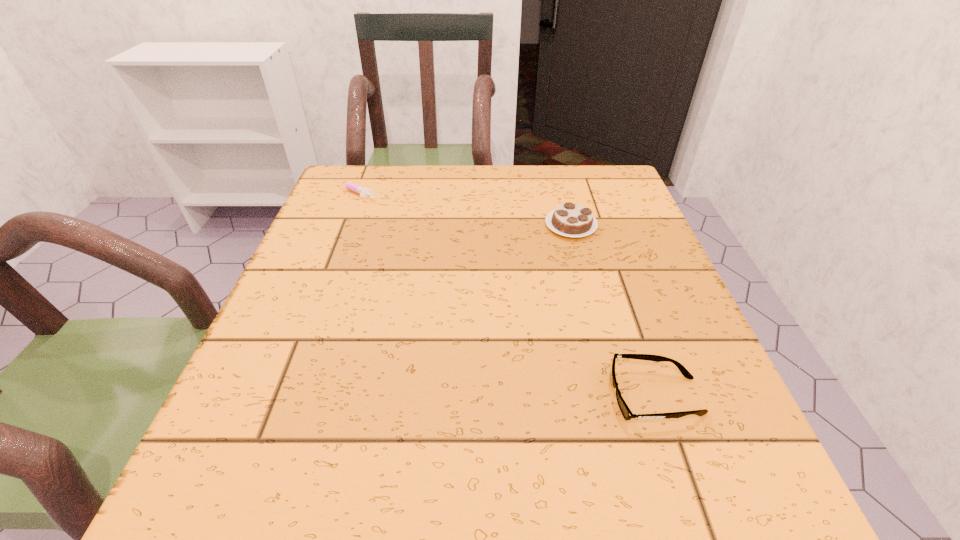
Where is `chocolate cake`? chocolate cake is located at coordinates (571, 220).

At what (x,y) coordinates should I click in order to perform the action: click on the nearest object. Please return your answer as a coordinate pair (x, y). The height and width of the screenshot is (540, 960). Looking at the image, I should click on (626, 412).

Identify the location of syringe. Image resolution: width=960 pixels, height=540 pixels. (363, 192).

Locate an element on the screen. the farthest object is located at coordinates (363, 192).

Image resolution: width=960 pixels, height=540 pixels. I want to click on free location located 0.150m on the left of the second farthest object, so click(478, 226).

The width and height of the screenshot is (960, 540). I want to click on free location located 0.350m on the front-facing side of the nearest object, so click(376, 396).

This screenshot has height=540, width=960. I want to click on free spot located on the front-facing side of the nearest object, so click(383, 396).

Identify the location of free space located on the front-facing side of the nearest object. (396, 396).

I want to click on free space located 0.080m on the right of the shortest object, so click(410, 192).

Identify the location of chocolate cake located in the far edge section of the desktop. Image resolution: width=960 pixels, height=540 pixels. (571, 220).